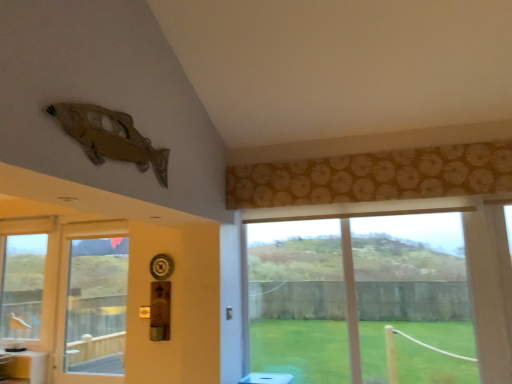
Question: From the image's perspective, is transparent glass door at left located above or below matte brown curtain at upper center?

Choices:
 (A) below
 (B) above

Answer: (A)

Question: Is transparent glass door at left taller or shorter than matte brown curtain at upper center?

Choices:
 (A) tall
 (B) short

Answer: (A)

Question: Which object is the closest to the white glossy counter top at lower left?

Choices:
 (A) transparent glass door at left
 (B) matte brown curtain at upper center
 (C) metallic brass door handle at lower center

Answer: (A)

Question: Which object is positioned closest to the metallic brass door handle at lower center?

Choices:
 (A) matte brown curtain at upper center
 (B) transparent glass door at left
 (C) white glossy counter top at lower left

Answer: (A)